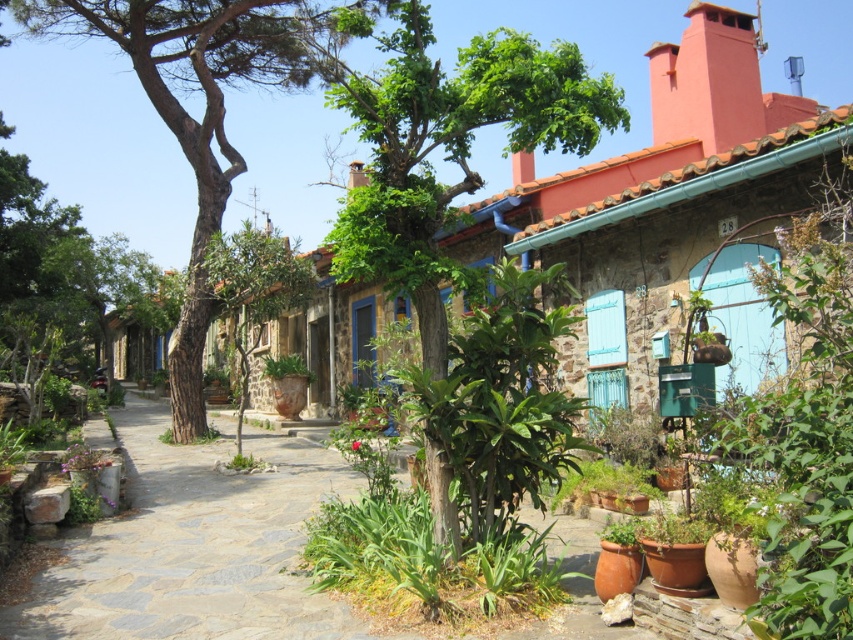
Is gray stone path at center below green leafy tree at center?

Indeed, gray stone path at center is positioned under green leafy tree at center.

Between gray stone path at center and green leafy tree at center, which one appears on the left side from the viewer's perspective?

From the viewer's perspective, gray stone path at center appears more on the left side.

Which is behind, point (248, 492) or point (393, 170)?

The point (248, 492) is behind.

I want to click on gray stone path at center, so click(x=195, y=545).

Which is behind, point (425, 216) or point (184, 416)?

Positioned behind is point (184, 416).

Looking at this image, does green leafy tree at center have a lesser width compared to brown rough bark tree at center?

Yes.

Between point (408, 193) and point (71, 29), which one is positioned behind?

The point (71, 29) is behind.

At what (x,y) coordinates should I click in order to perform the action: click on green leafy tree at center. Please return your answer as a coordinate pair (x, y). Looking at the image, I should click on (447, 147).

Between gray stone path at center and brown rough bark tree at center, which one appears on the right side from the viewer's perspective?

Positioned to the right is gray stone path at center.

Which of these two, gray stone path at center or brown rough bark tree at center, stands shorter?

With less height is gray stone path at center.

Is point (173, 604) closer to camera compared to point (207, 164)?

Yes, it is.

Where is `gray stone path at center`? Image resolution: width=853 pixels, height=640 pixels. gray stone path at center is located at coordinates (195, 545).